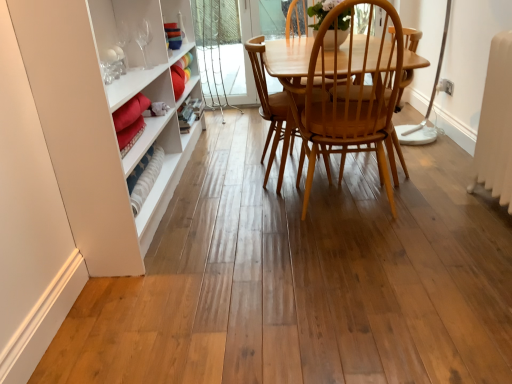
Locate an element on the screen. Image resolution: width=512 pixels, height=384 pixels. free space on the front side of light brown wood chair at center is located at coordinates (323, 289).